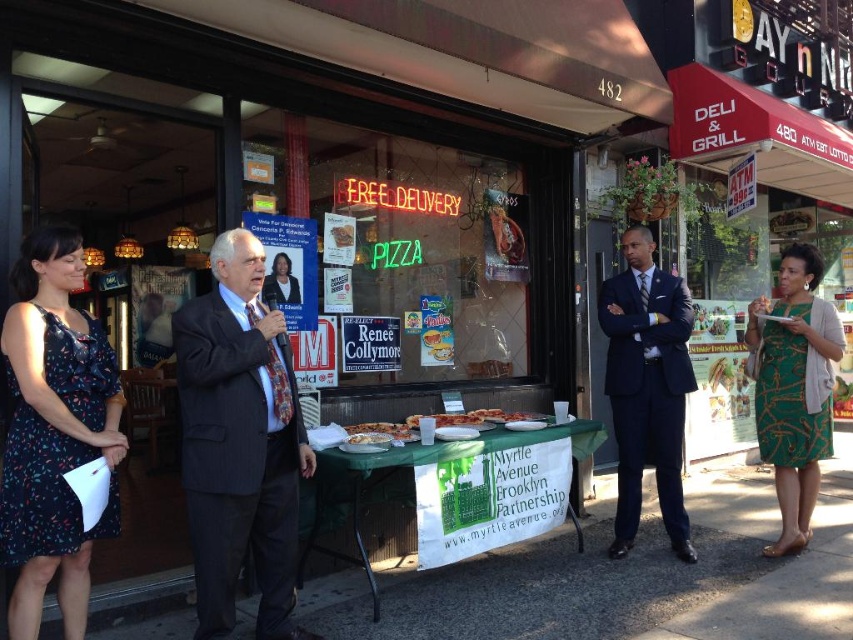
Question: Among these objects, which one is farthest from the camera?

Choices:
 (A) dark floral dress at left
 (B) green printed dress at right

Answer: (B)

Question: Among these objects, which one is farthest from the camera?

Choices:
 (A) dark floral dress at left
 (B) navy blue suit at center
 (C) green printed dress at right
 (D) pinstriped suit at center

Answer: (B)

Question: Is green printed dress at right behind matte black suit at center?

Choices:
 (A) yes
 (B) no

Answer: (A)

Question: Is pinstriped suit at center below navy blue suit at center?

Choices:
 (A) yes
 (B) no

Answer: (A)

Question: Which point is farther to the camera?

Choices:
 (A) (625, 458)
 (B) (793, 403)
 (C) (257, 417)

Answer: (A)

Question: Does dark floral dress at left have a smaller size compared to matte black suit at center?

Choices:
 (A) no
 (B) yes

Answer: (A)